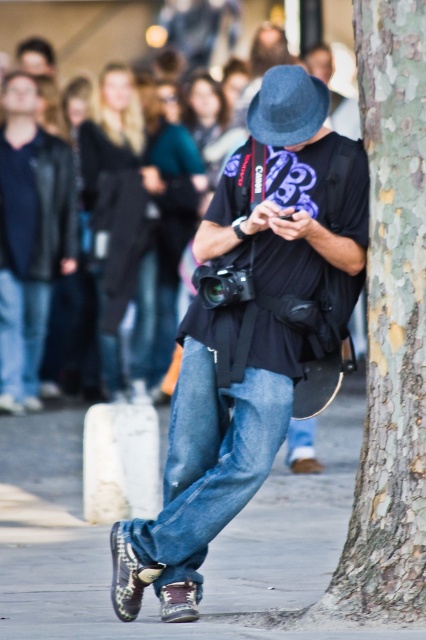
You are a delivery person who needs to place a package on the smooth concrete pavement at lower center. However, there is a matte black jacket at upper left nearby. Which object is closer to the right edge of the image so you can safely place the package there?

The smooth concrete pavement at lower center is positioned on the right side of matte black jacket at upper left, so it is closer to the right edge of the image. You can safely place the package there.

You are a photographer trying to capture a candid shot of the person in the scene. You notice the matte black jacket at upper left and the denim jeans at center. Which object should you focus on to ensure it fills more of your camera frame?

The matte black jacket at upper left is bigger than the denim jeans at center, so focusing on the matte black jacket at upper left will fill more of the camera frame.

You are a photographer trying to capture a candid shot of the person in the scene. You want to focus on the matte black jacket at upper left and the denim jeans at center. Which object should you adjust your camera to frame first if you want to start from the left side of the scene?

The matte black jacket at upper left should be framed first because it is positioned on the left side of the denim jeans at center.